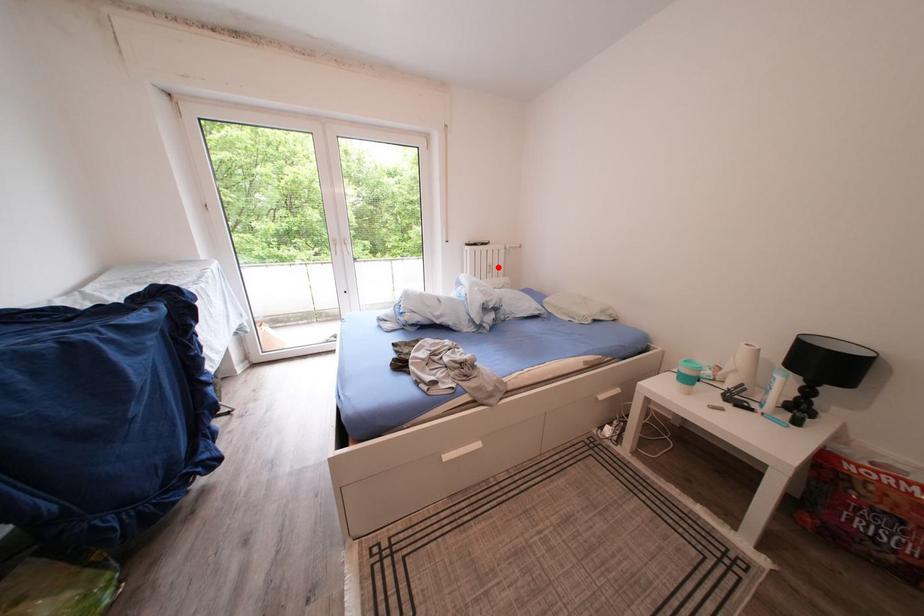
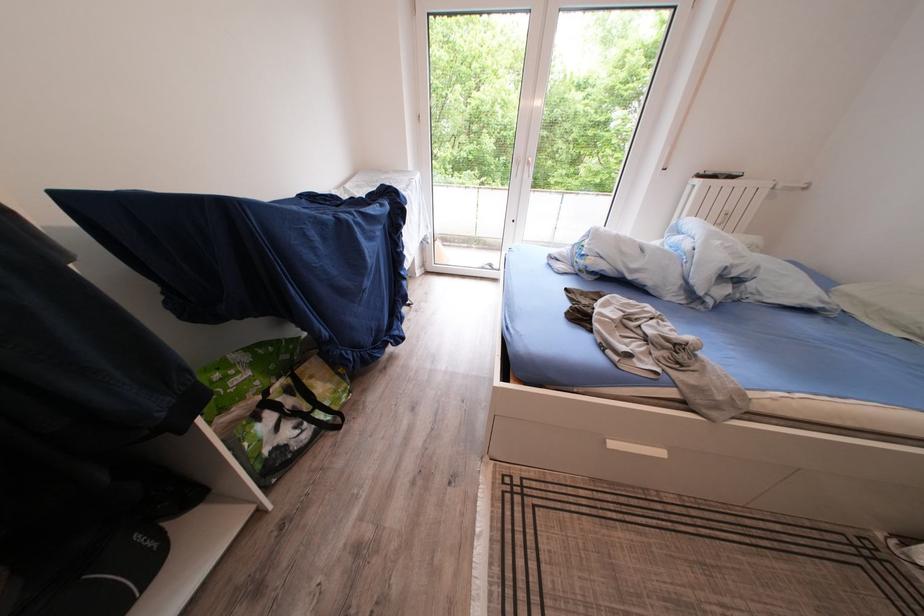
Question: I am providing you with two images of the same scene from different viewpoints. Image1 has a red point marked. In image2, the corresponding 3D location appears at what relative position? Reply with the corresponding letter.

Choices:
 (A) Closer
 (B) Farther

Answer: (B)